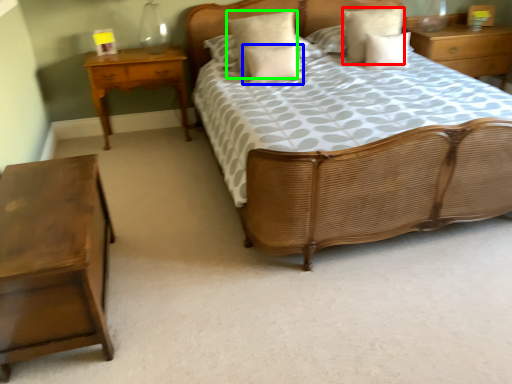
Question: Which object is the farthest from pillow (highlighted by a red box)? Choose among these: pillow (highlighted by a blue box) or pillow (highlighted by a green box).

Choices:
 (A) pillow
 (B) pillow

Answer: (A)